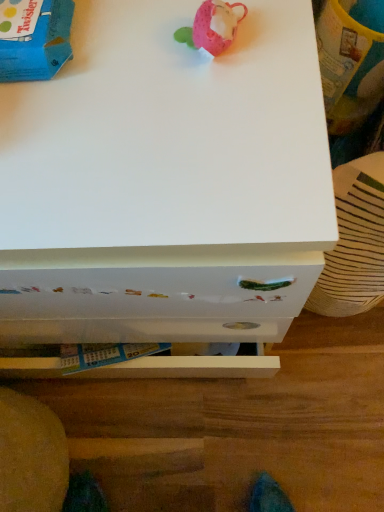
The image size is (384, 512). Identify the location of empty space that is to the right of blue cardboard box at upper left, which is counted as the first toy, starting from the left. (152, 55).